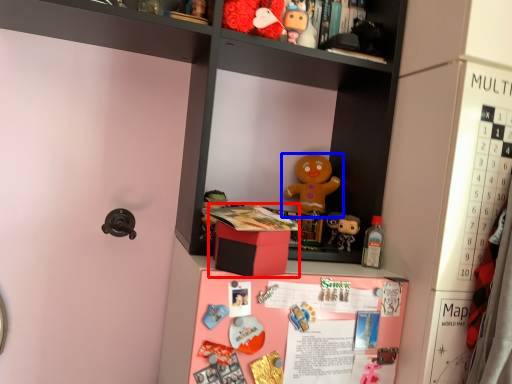
Question: Which object is closer to the camera taking this photo, box (highlighted by a red box) or toy (highlighted by a blue box)?

Choices:
 (A) box
 (B) toy

Answer: (A)